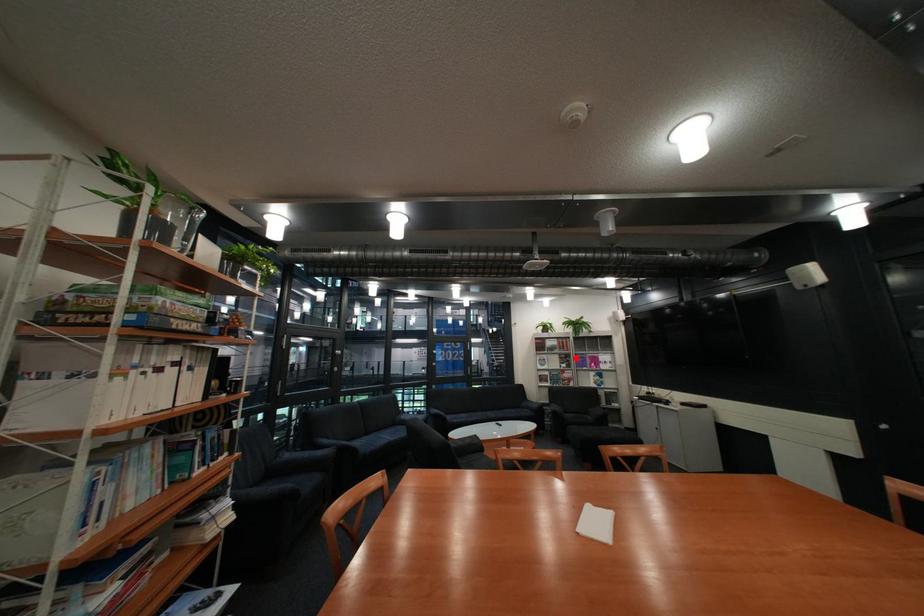
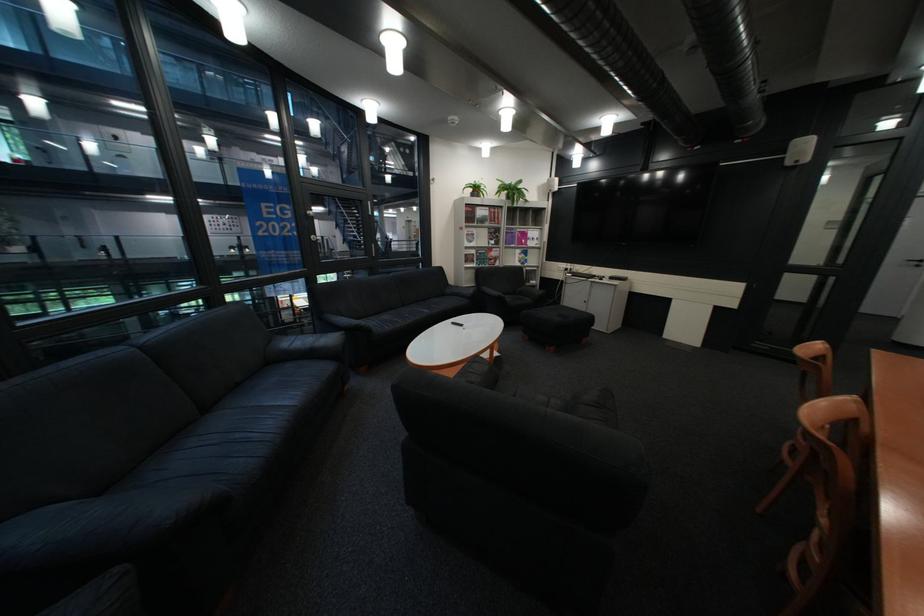
Locate, in the second image, the point that corresponds to the highlighted location in the first image.

(505, 233)